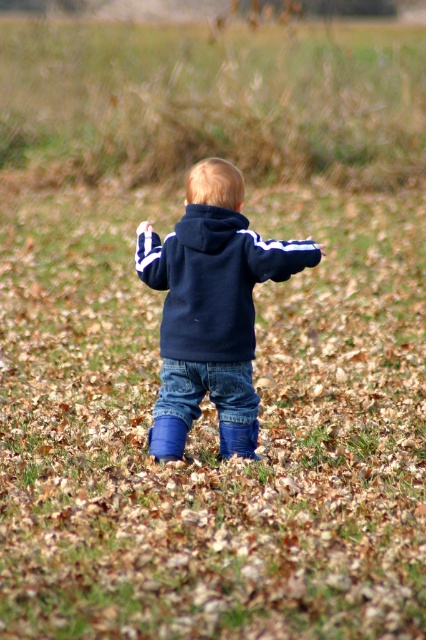
Can you confirm if green grass at upper center is smaller than navy fleece hoodie at center?

Incorrect, green grass at upper center is not smaller in size than navy fleece hoodie at center.

Can you confirm if green grass at upper center is positioned below navy fleece hoodie at center?

No.

Is point (196, 108) farther from camera compared to point (178, 324)?

Yes.

The width and height of the screenshot is (426, 640). I want to click on green grass at upper center, so click(213, 99).

What do you see at coordinates (210, 308) in the screenshot? I see `navy fleece hoodie at center` at bounding box center [210, 308].

Is navy fleece hoodie at center smaller than navy blue hoodie at center?

Incorrect, navy fleece hoodie at center is not smaller in size than navy blue hoodie at center.

Does point (229, 413) come closer to viewer compared to point (192, 259)?

No, (229, 413) is behind (192, 259).

Where is `navy fleece hoodie at center`? The image size is (426, 640). navy fleece hoodie at center is located at coordinates [x=210, y=308].

Measure the distance from navy blue hoodie at center to denim jeans at center.

navy blue hoodie at center is 13.21 inches from denim jeans at center.

Which is more to the left, navy blue hoodie at center or denim jeans at center?

denim jeans at center

Who is more distant from viewer, [229,275] or [158,432]?

Positioned behind is point [158,432].

Locate an element on the screen. This screenshot has height=640, width=426. navy blue hoodie at center is located at coordinates click(x=213, y=280).